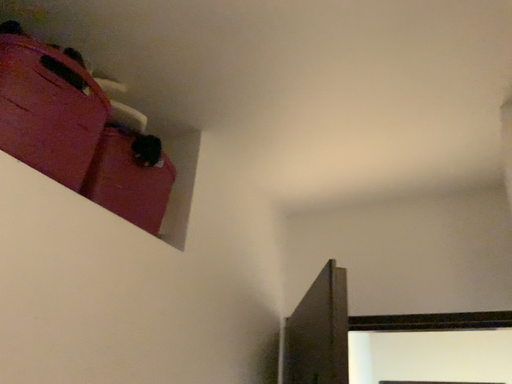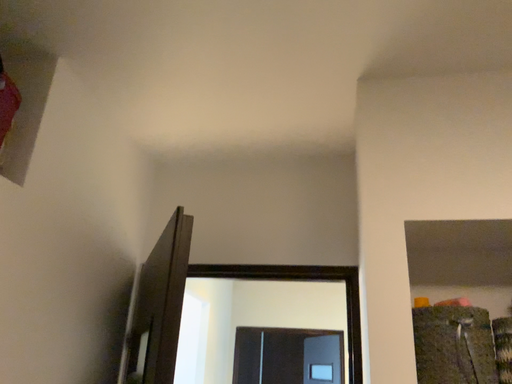
Question: Which way did the camera rotate in the video?

Choices:
 (A) rotated left
 (B) rotated right

Answer: (B)